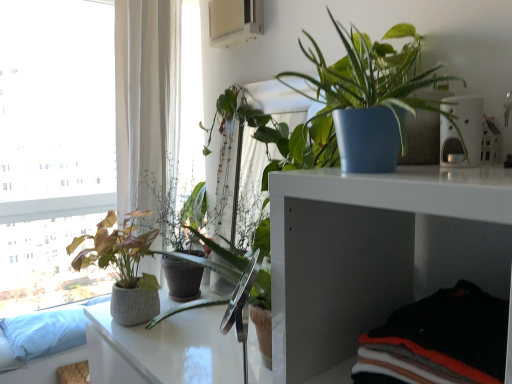
I want to click on dark cotton shirts at lower right, so click(438, 341).

Identify the location of white glass window at left. The width and height of the screenshot is (512, 384). (54, 146).

Describe the element at coordinates (461, 131) in the screenshot. I see `white plastic pet feeder at upper right` at that location.

The width and height of the screenshot is (512, 384). Identify the location of blue fabric couch at lower left. [x=36, y=363].

The image size is (512, 384). Describe the element at coordinates (36, 363) in the screenshot. I see `blue fabric couch at lower left` at that location.

Image resolution: width=512 pixels, height=384 pixels. Find the location of `textured gray pot at left, positioned as the 1th houseplant in back-to-front order`. textured gray pot at left, positioned as the 1th houseplant in back-to-front order is located at coordinates (123, 267).

Which object is more forward, blue matte pot at upper right, which is counted as the 1th houseplant, starting from the top, or textured gray pot at left, which is the first houseplant in bottom-to-top order?

Positioned in front is blue matte pot at upper right, which is counted as the 1th houseplant, starting from the top.

Is blue matte pot at upper right, the second houseplant viewed from the left, wider or thinner than textured gray pot at left, the second houseplant when ordered from right to left?

Considering their sizes, blue matte pot at upper right, the second houseplant viewed from the left, looks slimmer than textured gray pot at left, the second houseplant when ordered from right to left.

Could you tell me if blue matte pot at upper right, the 2th houseplant when ordered from bottom to top, is facing textured gray pot at left, placed as the 1th houseplant when sorted from left to right?

No, blue matte pot at upper right, the 2th houseplant when ordered from bottom to top, is not aimed at textured gray pot at left, placed as the 1th houseplant when sorted from left to right.

From a real-world perspective, is blue matte pot at upper right, which is counted as the 1th houseplant, starting from the top, physically located above or below white glossy table at center?

From a real-world perspective, blue matte pot at upper right, which is counted as the 1th houseplant, starting from the top, is physically above white glossy table at center.

Is point (391, 149) behind point (120, 357)?

That is False.

From the picture: Does blue matte pot at upper right, which is counted as the 1th houseplant, starting from the top, have a greater width compared to white glossy table at center?

In fact, blue matte pot at upper right, which is counted as the 1th houseplant, starting from the top, might be narrower than white glossy table at center.

Considering the relative sizes of blue matte pot at upper right, the 2th houseplant when ordered from bottom to top, and white glossy table at center in the image provided, is blue matte pot at upper right, the 2th houseplant when ordered from bottom to top, shorter than white glossy table at center?

Correct, blue matte pot at upper right, the 2th houseplant when ordered from bottom to top, is not as tall as white glossy table at center.

Between point (409, 26) and point (18, 181), which one is positioned behind?

The point (18, 181) is more distant.

Is blue matte pot at upper right, which is the 2th houseplant from back to front, positioned far away from white glass window at left?

Yes, blue matte pot at upper right, which is the 2th houseplant from back to front, is far from white glass window at left.

Is blue matte pot at upper right, which ranks as the first houseplant in right-to-left order, inside or outside of white glass window at left?

blue matte pot at upper right, which ranks as the first houseplant in right-to-left order, lies outside white glass window at left.

You are a GUI agent. You are given a task and a screenshot of the screen. Output one action in this format:
    pyautogui.click(x=<x>, y=<y>)
    Task: Click on the houseplant above the white glass window at left (from a real-world perspective)
    The image size is (512, 384).
    Given the screenshot: What is the action you would take?
    pyautogui.click(x=362, y=101)

Are white glass window at left and white plastic pet feeder at upper right far apart?

Absolutely, white glass window at left is distant from white plastic pet feeder at upper right.

From the image's perspective, which one is positioned lower, white glass window at left or white plastic pet feeder at upper right?

white plastic pet feeder at upper right, from the image's perspective.

In the image, is white glass window at left on the left side or the right side of white plastic pet feeder at upper right?

In the image, white glass window at left appears on the left side of white plastic pet feeder at upper right.

Is white glass window at left positioned with its back to white plastic pet feeder at upper right?

No, white glass window at left is not facing the opposite direction of white plastic pet feeder at upper right.

Are blue fabric couch at lower left and white glass window at left far apart?

Yes, blue fabric couch at lower left and white glass window at left are located far from each other.

Locate an element on the screen. window on the left of blue fabric couch at lower left is located at coordinates (54, 146).

Which is in front, blue fabric couch at lower left or white glass window at left?

blue fabric couch at lower left.

Which object is closer to the camera, white glossy table at center or textured gray pot at left, marked as the second houseplant in a top-to-bottom arrangement?

white glossy table at center is in front.

Considering the sizes of objects white glossy table at center and textured gray pot at left, which is the first houseplant in bottom-to-top order, in the image provided, who is shorter, white glossy table at center or textured gray pot at left, which is the first houseplant in bottom-to-top order,?

With less height is textured gray pot at left, which is the first houseplant in bottom-to-top order.

Which is more to the right, white glossy table at center or textured gray pot at left, placed as the 1th houseplant when sorted from left to right?

Positioned to the right is white glossy table at center.

How many degrees apart are the facing directions of white glossy table at center and textured gray pot at left, marked as the second houseplant in a top-to-bottom arrangement?

The angle between the facing direction of white glossy table at center and the facing direction of textured gray pot at left, marked as the second houseplant in a top-to-bottom arrangement, is 4.25 degrees.

Which is more to the right, white plastic pet feeder at upper right or textured gray pot at left, marked as the second houseplant in a top-to-bottom arrangement?

From the viewer's perspective, white plastic pet feeder at upper right appears more on the right side.

Is white plastic pet feeder at upper right touching textured gray pot at left, positioned as the 1th houseplant in back-to-front order?

No.

Which is correct: white plastic pet feeder at upper right is inside textured gray pot at left, which is the first houseplant in bottom-to-top order, or outside of it?

white plastic pet feeder at upper right cannot be found inside textured gray pot at left, which is the first houseplant in bottom-to-top order.

I want to click on houseplant located in front of the textured gray pot at left, the second houseplant positioned from the front, so click(x=362, y=101).

Locate an element on the screen. table located behind the blue matte pot at upper right, the second houseplant viewed from the left is located at coordinates (163, 349).

Estimate the real-world distances between objects in this image. Which object is closer to white glossy table at center, white glass window at left or textured gray pot at left, the second houseplant when ordered from right to left?

textured gray pot at left, the second houseplant when ordered from right to left, is closer to white glossy table at center.

Considering their positions, is blue fabric couch at lower left positioned further to blue matte pot at upper right, which ranks as the first houseplant in right-to-left order, than dark cotton shirts at lower right?

The object further to blue matte pot at upper right, which ranks as the first houseplant in right-to-left order, is blue fabric couch at lower left.

Based on their spatial positions, is textured gray pot at left, placed as the 1th houseplant when sorted from left to right, or dark cotton shirts at lower right closer to white plastic pet feeder at upper right?

Among the two, dark cotton shirts at lower right is located nearer to white plastic pet feeder at upper right.

Considering their positions, is white glass window at left positioned closer to white glossy table at center than white plastic pet feeder at upper right?

Based on the image, white plastic pet feeder at upper right appears to be nearer to white glossy table at center.

Based on the photo, based on their spatial positions, is white plastic pet feeder at upper right or blue fabric couch at lower left closer to white glass window at left?

blue fabric couch at lower left is positioned closer to the anchor white glass window at left.

Which object lies further to the anchor point blue fabric couch at lower left, white glass window at left or white plastic pet feeder at upper right?

white plastic pet feeder at upper right is further to blue fabric couch at lower left.

Based on the photo, when comparing their distances from white glossy table at center, does textured gray pot at left, which is the first houseplant in bottom-to-top order, or white glass window at left seem further?

The object further to white glossy table at center is white glass window at left.

Based on their spatial positions, is white plastic pet feeder at upper right or white glossy table at center closer to dark cotton shirts at lower right?

white plastic pet feeder at upper right is closer to dark cotton shirts at lower right.

Locate an element on the screen. houseplant situated between textured gray pot at left, the second houseplant positioned from the front, and white plastic pet feeder at upper right from left to right is located at coordinates (362, 101).

Where is `couch between dark cotton shirts at lower right and white glass window at left from front to back`? This screenshot has width=512, height=384. couch between dark cotton shirts at lower right and white glass window at left from front to back is located at coordinates [36, 363].

Identify the location of clothing between white plastic pet feeder at upper right and white glossy table at center vertically. (438, 341).

Identify the location of couch located between textured gray pot at left, the second houseplant when ordered from right to left, and white glass window at left in the depth direction. The width and height of the screenshot is (512, 384). (36, 363).